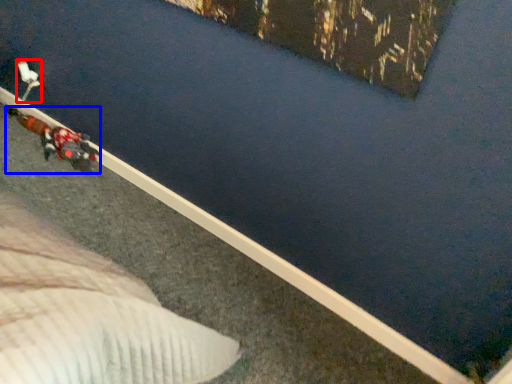
Question: Which point is closer to the camera, toy (highlighted by a red box) or person (highlighted by a blue box)?

Choices:
 (A) toy
 (B) person

Answer: (B)